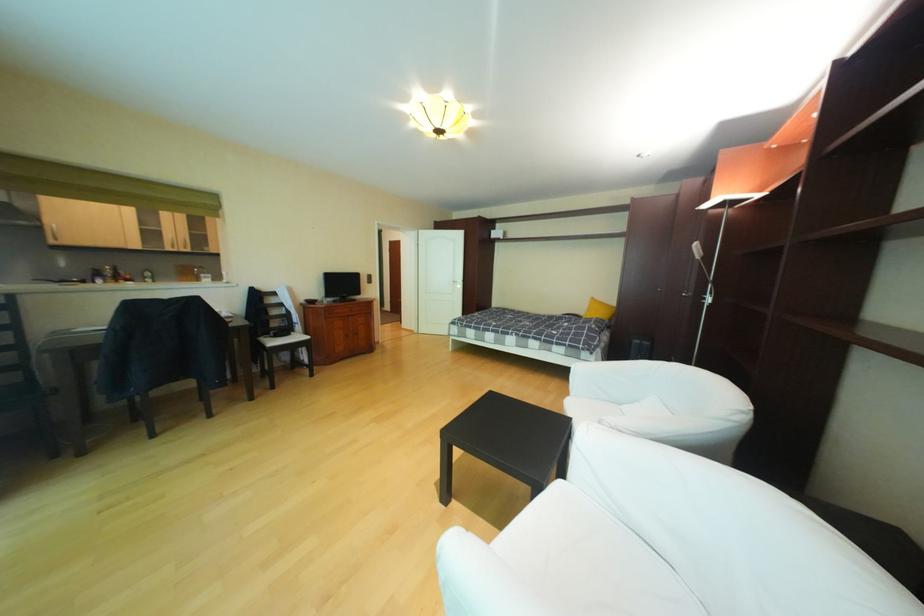
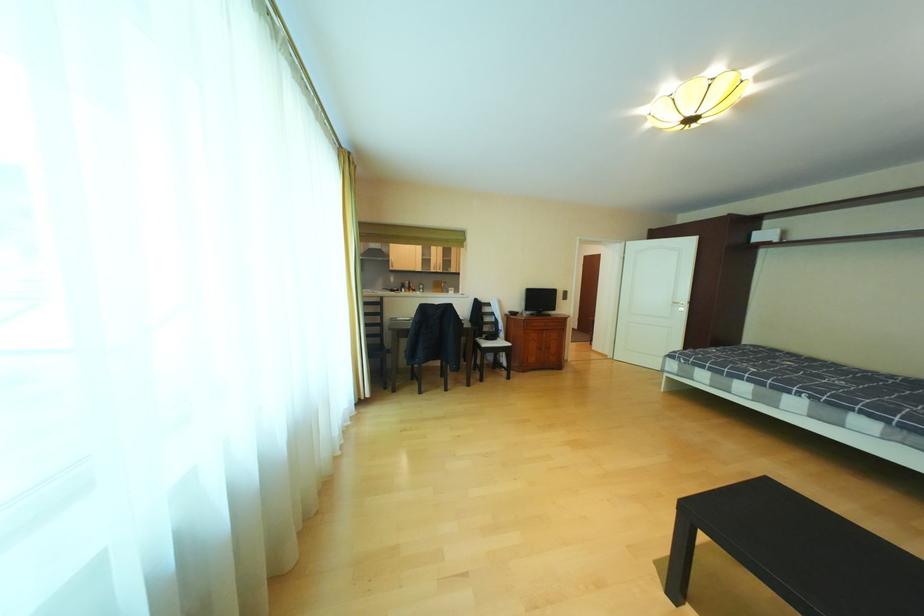
Where in the second image is the point corresponding to point 503,398 from the first image?

(782, 488)